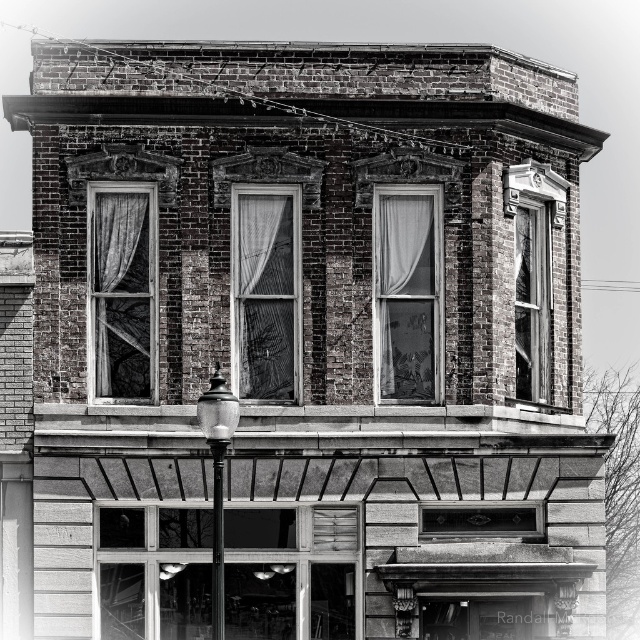
Question: Which object appears closest to the camera in this image?

Choices:
 (A) transparent glass window at upper right
 (B) clear glass window at upper right
 (C) translucent fabric window at center
 (D) translucent fabric curtain at left

Answer: (D)

Question: Which point appears closest to the camera in this image?

Choices:
 (A) (436, 253)
 (B) (93, 225)

Answer: (B)

Question: Is the position of translucent fabric curtain at left more distant than that of translucent glass window at center?

Choices:
 (A) no
 (B) yes

Answer: (A)

Question: Does translucent fabric curtain at left appear on the left side of metallic pole at center?

Choices:
 (A) no
 (B) yes

Answer: (B)

Question: Which of the following is the farthest from the observer?

Choices:
 (A) translucent fabric curtain at left
 (B) translucent glass window at center

Answer: (B)

Question: Is translucent fabric curtain at left to the left of translucent glass window at center from the viewer's perspective?

Choices:
 (A) yes
 (B) no

Answer: (A)